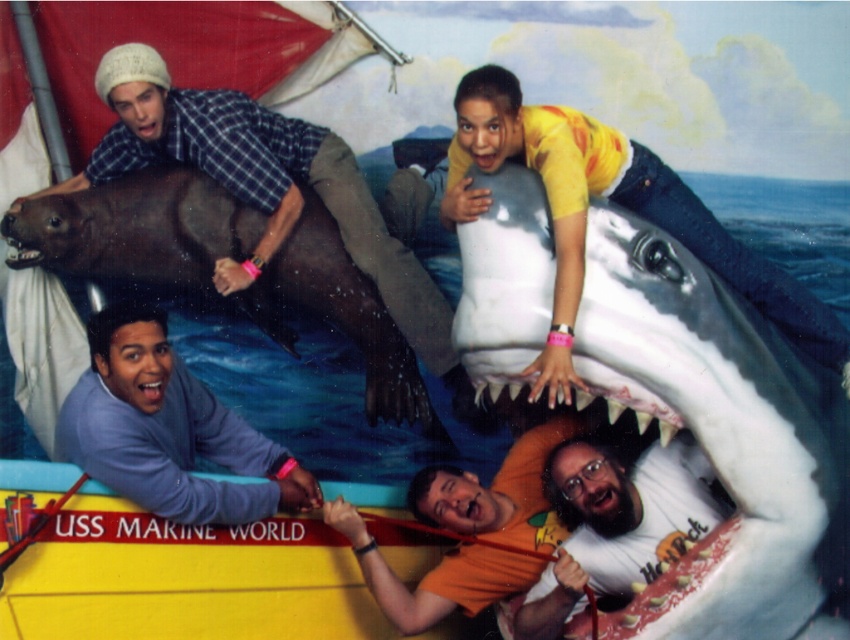
Does point (108, 154) come closer to viewer compared to point (496, 168)?

That is False.

Between smooth brown seal at upper left and white glossy shark mouth at upper center, which one is positioned higher?

Positioned higher is white glossy shark mouth at upper center.

Is point (109, 83) farther from camera compared to point (473, 145)?

Yes, it is behind point (473, 145).

Locate an element on the screen. The width and height of the screenshot is (850, 640). smooth brown seal at upper left is located at coordinates (268, 188).

Is point (514, 460) less distant than point (150, 392)?

No, (514, 460) is behind (150, 392).

Can you confirm if orange matte shirt at lower center is smaller than pink matte mouth at lower left?

Actually, orange matte shirt at lower center might be larger than pink matte mouth at lower left.

In the scene shown: Measure the distance between point (477, 592) and camera.

Point (477, 592) is 6.81 meters from camera.

Find the location of a particular element. orange matte shirt at lower center is located at coordinates (499, 492).

Can you confirm if gray matte shark at upper right is positioned above matte black mouth at upper center?

Incorrect, gray matte shark at upper right is not positioned above matte black mouth at upper center.

Which is behind, point (707, 620) or point (153, 120)?

The point (153, 120) is behind.

Where is `gray matte shark at upper right`? gray matte shark at upper right is located at coordinates (720, 422).